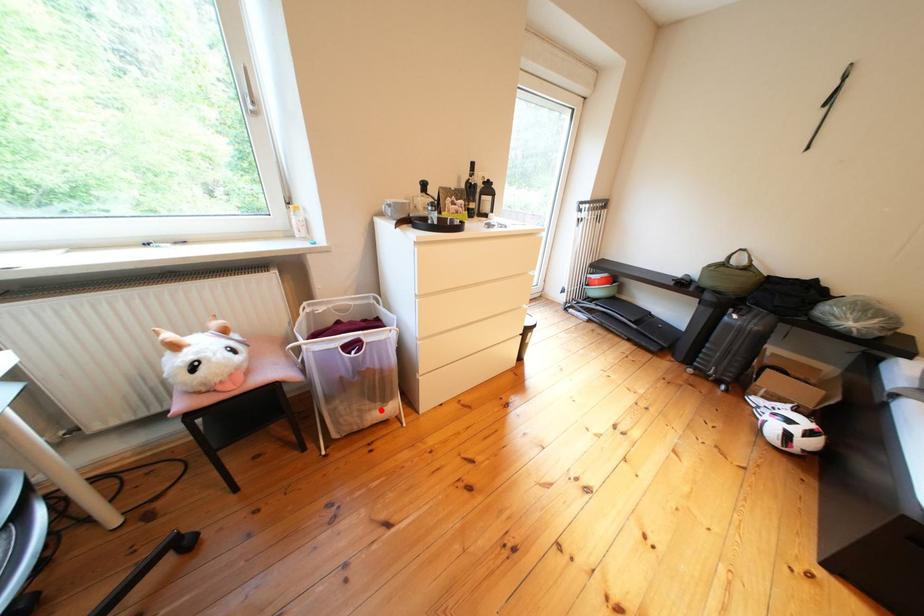
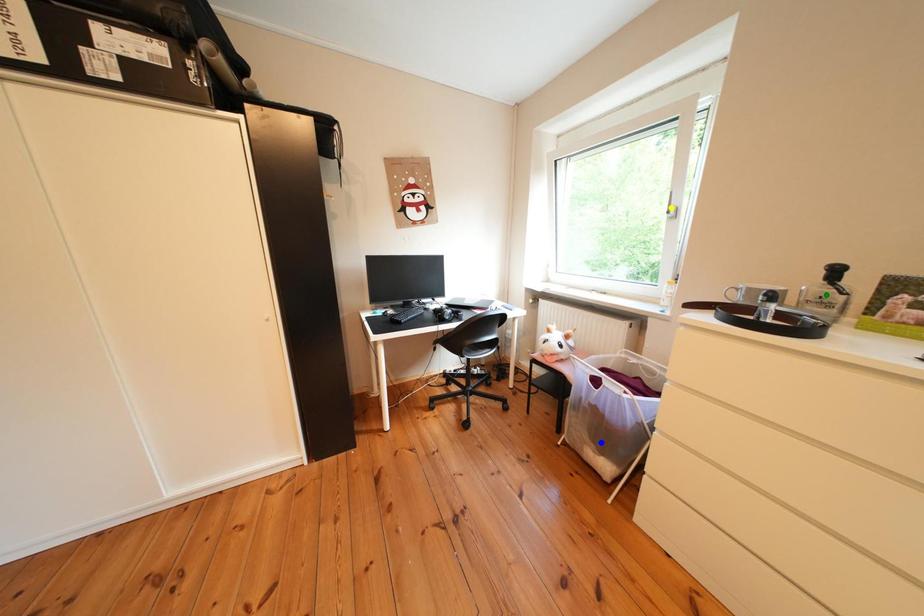
Question: I am providing you with two images of the same scene from different viewpoints. A red point is marked on the first image. You are given multiple points on the second image. In image 2, which mark is for the same physical point as the one in image 1?

Choices:
 (A) blue point
 (B) yellow point
 (C) green point

Answer: (A)